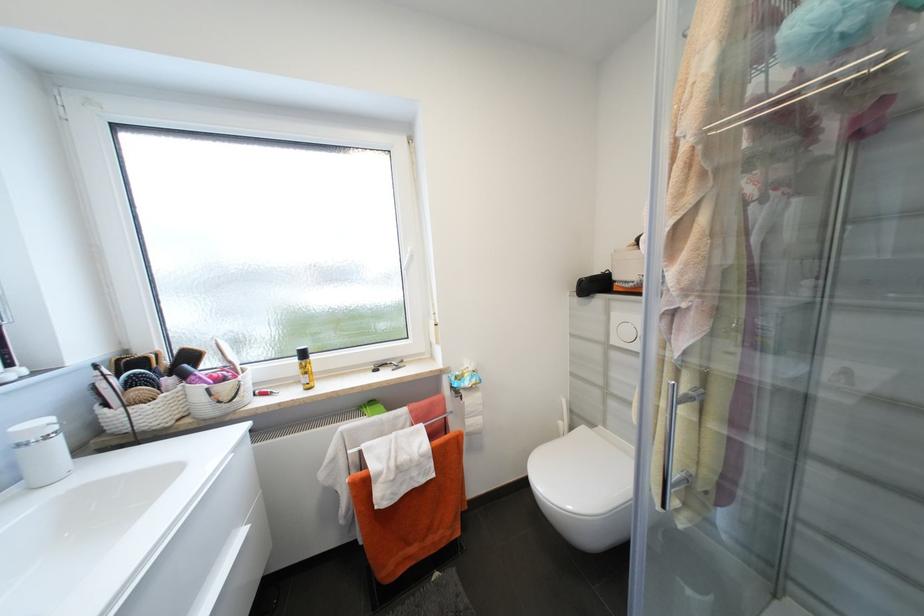
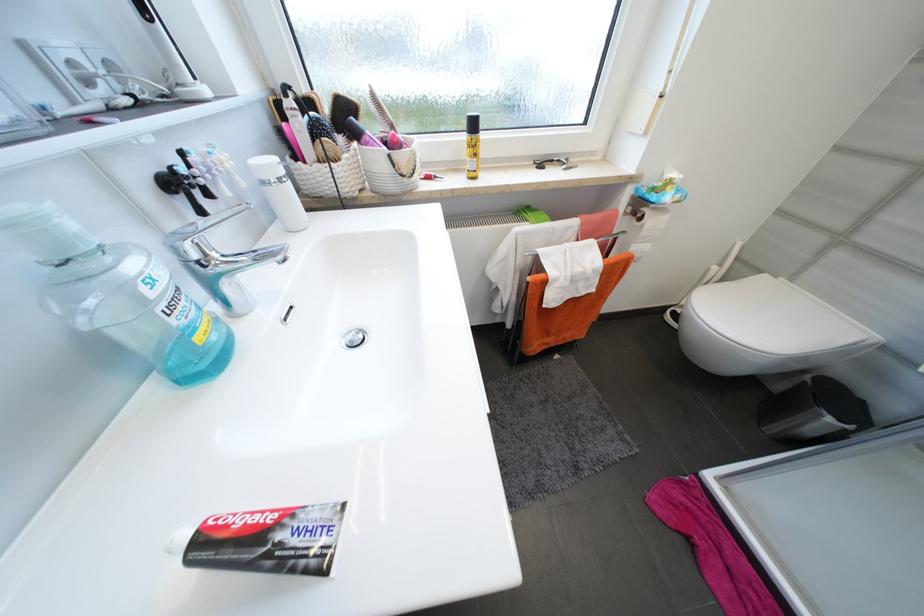
Where in the second image is the point corresponding to (x=112, y=406) from the first image?

(304, 158)